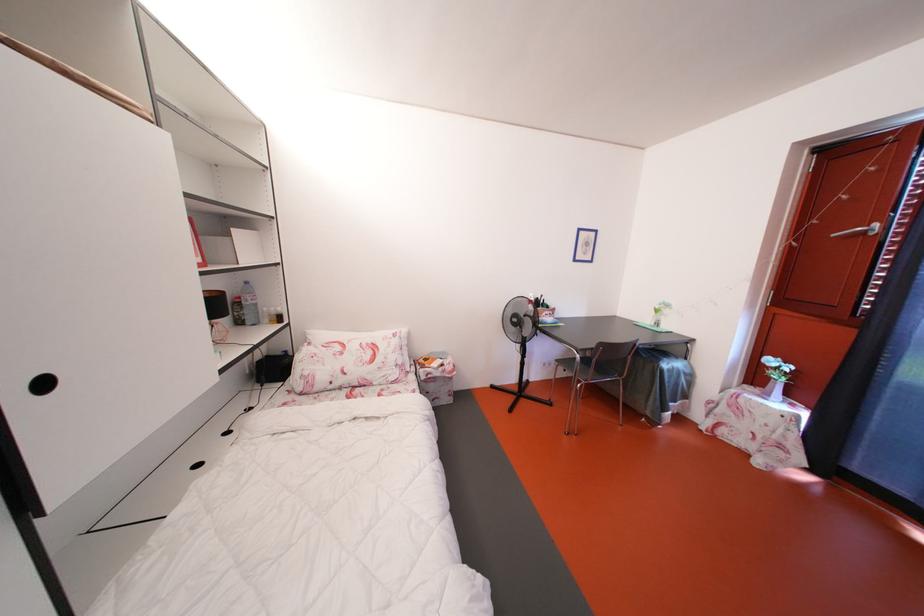
What do you see at coordinates (858, 231) in the screenshot? Image resolution: width=924 pixels, height=616 pixels. I see `a silver door handle` at bounding box center [858, 231].